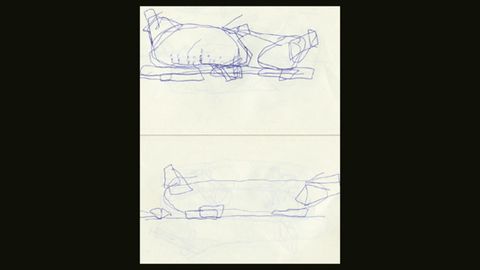
This screenshot has width=480, height=270. I want to click on divider, so click(x=225, y=134).